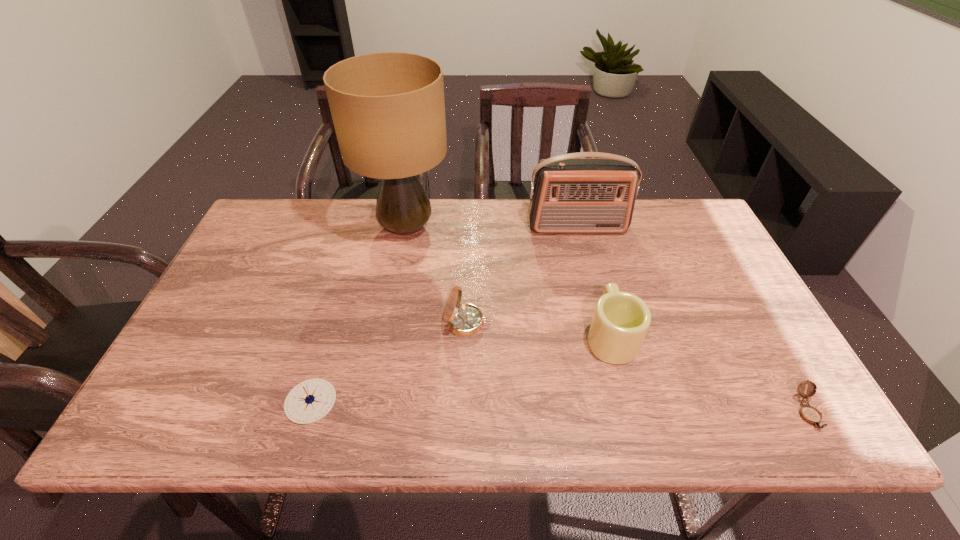
Locate an element on the screen. The height and width of the screenshot is (540, 960). the tallest object is located at coordinates (388, 109).

The width and height of the screenshot is (960, 540). Find the location of `the fifth shortest object`. the fifth shortest object is located at coordinates (569, 194).

Find the location of a particular element. Image resolution: width=960 pixels, height=540 pixels. mug is located at coordinates (620, 322).

I want to click on the second compass from right to left, so click(464, 320).

I want to click on the tallest compass, so click(x=464, y=320).

Identify the location of the leftmost compass. (311, 400).

This screenshot has width=960, height=540. I want to click on the rightmost object, so click(811, 415).

In order to click on vacant area located on the front of the tallest object in this screenshot , I will do `click(389, 320)`.

Identify the location of vacant space situated 0.050m on the front-facing side of the radio receiver. The height and width of the screenshot is (540, 960). (582, 247).

Identify the location of vacant space located with the handle on the side of the mug. coord(586,239).